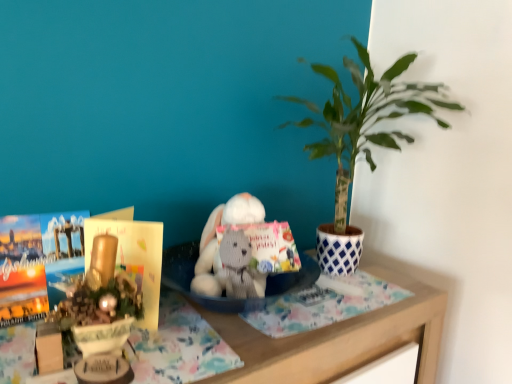
Question: From the image's perspective, is wooden table at center over gray knitted stuffed animal at center?

Choices:
 (A) no
 (B) yes

Answer: (A)

Question: Considering the relative sizes of wooden table at center and gray knitted stuffed animal at center in the image provided, is wooden table at center thinner than gray knitted stuffed animal at center?

Choices:
 (A) yes
 (B) no

Answer: (B)

Question: Considering the relative sizes of wooden table at center and gray knitted stuffed animal at center in the image provided, is wooden table at center wider than gray knitted stuffed animal at center?

Choices:
 (A) yes
 (B) no

Answer: (A)

Question: Is wooden table at center turned away from gray knitted stuffed animal at center?

Choices:
 (A) yes
 (B) no

Answer: (B)

Question: Considering the relative positions of wooden table at center and gray knitted stuffed animal at center in the image provided, is wooden table at center to the right of gray knitted stuffed animal at center from the viewer's perspective?

Choices:
 (A) yes
 (B) no

Answer: (A)

Question: From the image's perspective, is green leafy plant at upper right located above or below wooden table at center?

Choices:
 (A) below
 (B) above

Answer: (B)

Question: Visually, is green leafy plant at upper right positioned to the left or to the right of wooden table at center?

Choices:
 (A) right
 (B) left

Answer: (A)

Question: In the image, is green leafy plant at upper right positioned in front of or behind wooden table at center?

Choices:
 (A) behind
 (B) front

Answer: (A)

Question: Looking at their shapes, would you say green leafy plant at upper right is wider or thinner than wooden table at center?

Choices:
 (A) thin
 (B) wide

Answer: (A)

Question: Is green leafy plant at upper right in front of or behind gray knitted stuffed animal at center in the image?

Choices:
 (A) behind
 (B) front

Answer: (A)

Question: Considering the positions of green leafy plant at upper right and gray knitted stuffed animal at center in the image, is green leafy plant at upper right taller or shorter than gray knitted stuffed animal at center?

Choices:
 (A) short
 (B) tall

Answer: (B)

Question: Considering the positions of point (446, 102) and point (230, 244), is point (446, 102) closer or farther from the camera than point (230, 244)?

Choices:
 (A) farther
 (B) closer

Answer: (A)

Question: Looking at their shapes, would you say green leafy plant at upper right is wider or thinner than gray knitted stuffed animal at center?

Choices:
 (A) wide
 (B) thin

Answer: (A)

Question: Based on their sizes in the image, would you say gray knitted stuffed animal at center is bigger or smaller than wooden table at center?

Choices:
 (A) big
 (B) small

Answer: (B)

Question: Is point (240, 241) closer or farther from the camera than point (262, 349)?

Choices:
 (A) closer
 (B) farther

Answer: (B)